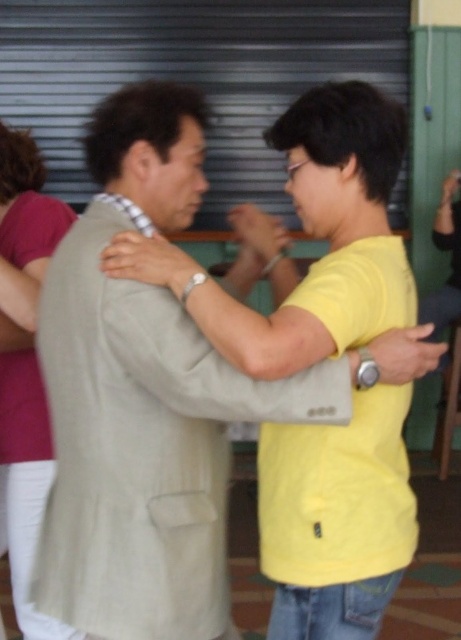
You are planning to hang a picture frame that requires a hook 1.5 meters high on the wall. You see the light beige suit at center and the matte pink shirt at left in the scene. Which object should you use as a reference to ensure the hook is placed at the correct height?

The matte pink shirt at left is taller than the light beige suit at center, so you should use the matte pink shirt at left as a reference to estimate the required height for the hook.

You are planning to take a photo of the light beige suit at center and the matte pink shirt at left. Based on their positions, which one should you focus on first to capture both in the frame?

The light beige suit at center is to the right of the matte pink shirt at left, so you should focus on the matte pink shirt at left first to ensure both are in the frame.

You are a photographer trying to capture the light beige suit at center. You have a camera with a fixed focus point at the center of the frame. The focus point is at coordinate point [338,524]. Will the focus point successfully capture the light beige suit at center?

Yes, the focus point at coordinate point [338,524] corresponds to the light beige suit at center, so the focus point will successfully capture the light beige suit at center.